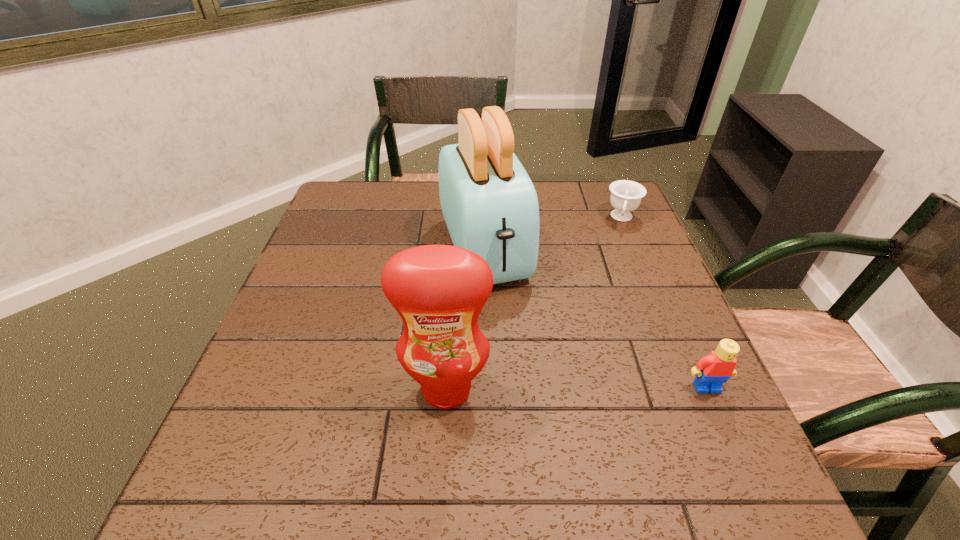
What are the coordinates of `teacup that is at the far edge` in the screenshot? It's located at (626, 195).

The width and height of the screenshot is (960, 540). Find the location of `toaster located at the far edge`. toaster located at the far edge is located at coordinates (490, 206).

Locate an element on the screen. The height and width of the screenshot is (540, 960). object that is at the near edge is located at coordinates (439, 291).

This screenshot has width=960, height=540. In order to click on Lego situated at the right edge in this screenshot , I will do `click(712, 371)`.

Find the location of `teacup that is at the right edge`. teacup that is at the right edge is located at coordinates (626, 195).

I want to click on object that is positioned at the far right corner, so click(x=626, y=195).

Where is `vacant space at the far edge`? The width and height of the screenshot is (960, 540). vacant space at the far edge is located at coordinates (544, 196).

You are a GUI agent. You are given a task and a screenshot of the screen. Output one action in this format:
    pyautogui.click(x=<x>, y=<y>)
    Task: Click on the vacant region at the near edge of the desktop
    
    Given the screenshot: What is the action you would take?
    pyautogui.click(x=493, y=404)

The width and height of the screenshot is (960, 540). Identify the location of vacant space at the left edge. (295, 279).

This screenshot has width=960, height=540. In the image, there is a desktop. Identify the location of vacant space at the right edge. (658, 352).